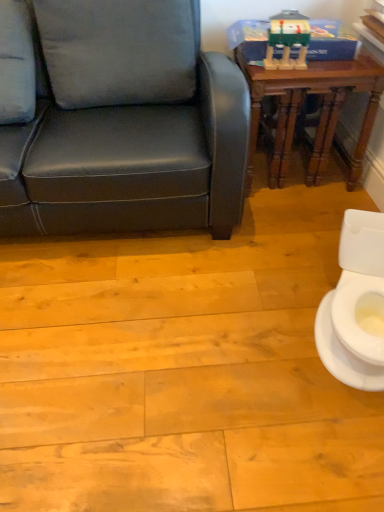
Question: Is white glossy toilet at lower right positioned beyond the bounds of wooden table at upper right?

Choices:
 (A) yes
 (B) no

Answer: (A)

Question: Does white glossy toilet at lower right have a greater width compared to wooden table at upper right?

Choices:
 (A) yes
 (B) no

Answer: (B)

Question: From a real-world perspective, is white glossy toilet at lower right positioned over wooden table at upper right based on gravity?

Choices:
 (A) yes
 (B) no

Answer: (B)

Question: Is white glossy toilet at lower right bigger than wooden table at upper right?

Choices:
 (A) yes
 (B) no

Answer: (B)

Question: Considering the relative sizes of white glossy toilet at lower right and wooden table at upper right in the image provided, is white glossy toilet at lower right taller than wooden table at upper right?

Choices:
 (A) no
 (B) yes

Answer: (A)

Question: Considering the relative positions of white glossy toilet at lower right and wooden table at upper right in the image provided, is white glossy toilet at lower right to the right of wooden table at upper right from the viewer's perspective?

Choices:
 (A) no
 (B) yes

Answer: (B)

Question: Would you say wooden table at upper right contains matte green plastic toy at upper right?

Choices:
 (A) yes
 (B) no

Answer: (B)

Question: Is wooden table at upper right in front of matte green plastic toy at upper right?

Choices:
 (A) yes
 (B) no

Answer: (B)

Question: Does wooden table at upper right have a larger size compared to matte green plastic toy at upper right?

Choices:
 (A) no
 (B) yes

Answer: (B)

Question: Is wooden table at upper right aimed at matte green plastic toy at upper right?

Choices:
 (A) yes
 (B) no

Answer: (B)

Question: From the image's perspective, is wooden table at upper right under matte green plastic toy at upper right?

Choices:
 (A) no
 (B) yes

Answer: (B)

Question: From a real-world perspective, is wooden table at upper right over matte green plastic toy at upper right?

Choices:
 (A) no
 (B) yes

Answer: (A)

Question: From the image's perspective, is wooden table at upper right on top of white fabric pillow at upper left?

Choices:
 (A) no
 (B) yes

Answer: (A)